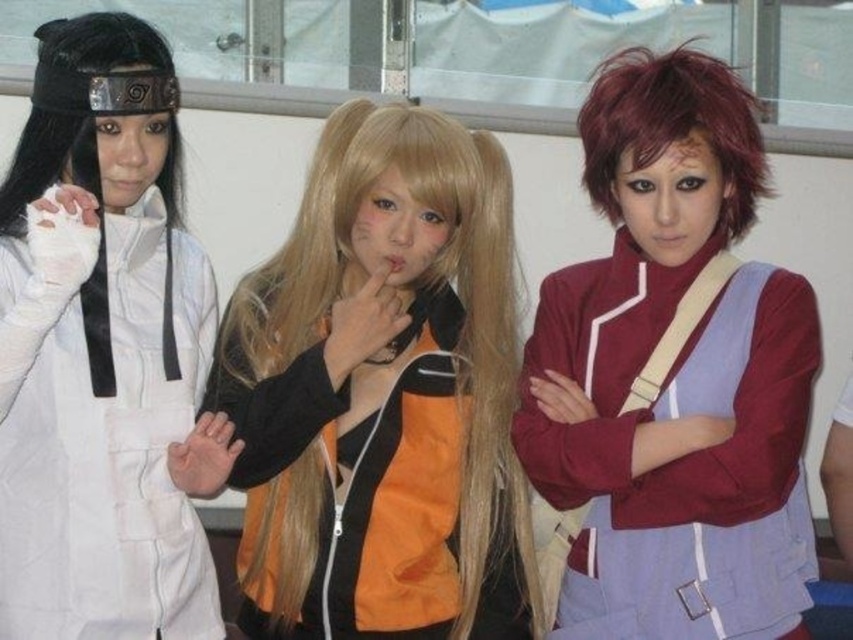
Question: Does maroon fabric jacket at center have a smaller size compared to white matte glove at left?

Choices:
 (A) no
 (B) yes

Answer: (A)

Question: Which of these objects is positioned closest to the shiny orange jacket at center?

Choices:
 (A) short red hair at center
 (B) white matte glove at left

Answer: (B)

Question: Which of the following is the farthest from the observer?

Choices:
 (A) (453, 230)
 (B) (107, 518)
 (C) (755, 182)

Answer: (A)

Question: Considering the real-world distances, which object is farthest from the shiny orange jacket at center?

Choices:
 (A) short red hair at center
 (B) white matte glove at left
 (C) maroon fabric jacket at center

Answer: (A)

Question: Does shiny orange jacket at center have a smaller size compared to short red hair at center?

Choices:
 (A) yes
 (B) no

Answer: (B)

Question: Can you confirm if shiny orange jacket at center is positioned to the left of maroon fabric jacket at center?

Choices:
 (A) yes
 (B) no

Answer: (A)